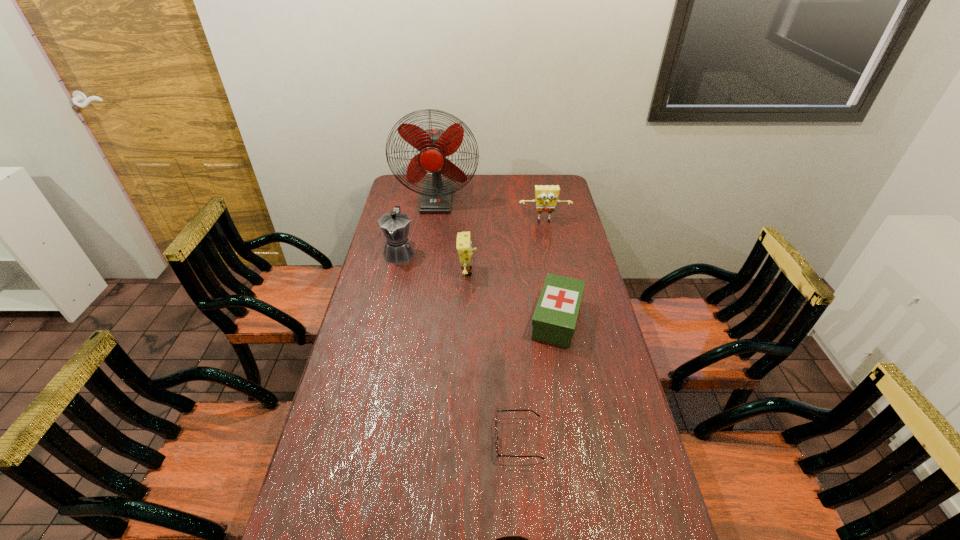
I want to click on free space located 0.290m at the spout of the coffeepot, so click(x=385, y=320).

Identify the location of vacant space located 0.100m on the face of the right sponge. Image resolution: width=960 pixels, height=540 pixels. (548, 239).

Locate an element on the screen. The width and height of the screenshot is (960, 540). vacant space situated on the face of the nearer sponge is located at coordinates (570, 272).

Where is `vacant space located on the left of the third nearest object`? vacant space located on the left of the third nearest object is located at coordinates (470, 319).

Where is `free space located 0.140m on the lenses of the spectacles`? The height and width of the screenshot is (540, 960). free space located 0.140m on the lenses of the spectacles is located at coordinates (444, 439).

The height and width of the screenshot is (540, 960). Identify the location of vacant space situated 0.210m on the lenses of the spectacles. (419, 439).

Image resolution: width=960 pixels, height=540 pixels. I want to click on vacant region located on the lenses of the spectacles, so click(448, 439).

Identify the location of object that is at the far edge. The height and width of the screenshot is (540, 960). (434, 145).

What are the coordinates of `fan located at the left edge` in the screenshot? It's located at (434, 145).

Locate an element on the screen. This screenshot has height=540, width=960. coffeepot that is positioned at the left edge is located at coordinates (395, 225).